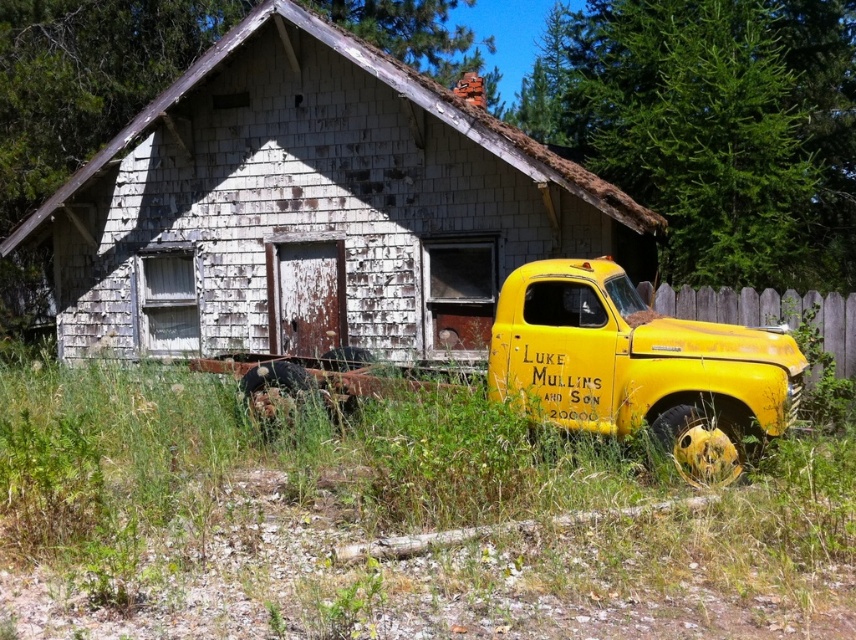
Question: Is green grass at lower center to the right of rusty yellow truck at right from the viewer's perspective?

Choices:
 (A) no
 (B) yes

Answer: (A)

Question: Which of the following is the closest to the observer?

Choices:
 (A) pos(4,598)
 (B) pos(494,316)

Answer: (A)

Question: Can you confirm if green grass at lower center is thinner than rusty yellow truck at right?

Choices:
 (A) yes
 (B) no

Answer: (A)

Question: Does green grass at lower center appear on the left side of rusty yellow truck at right?

Choices:
 (A) yes
 (B) no

Answer: (A)

Question: Among these points, which one is nearest to the camera?

Choices:
 (A) (170, 371)
 (B) (776, 339)

Answer: (B)